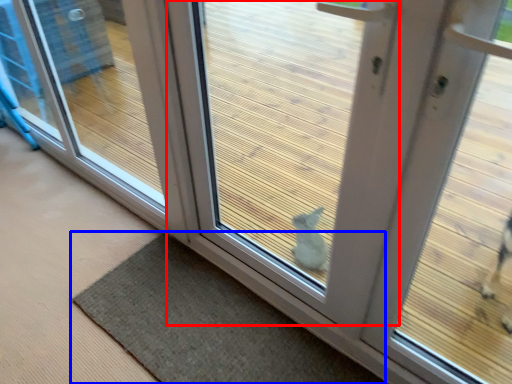
Question: Which object is further to the camera taking this photo, door (highlighted by a red box) or mat (highlighted by a blue box)?

Choices:
 (A) door
 (B) mat

Answer: (B)